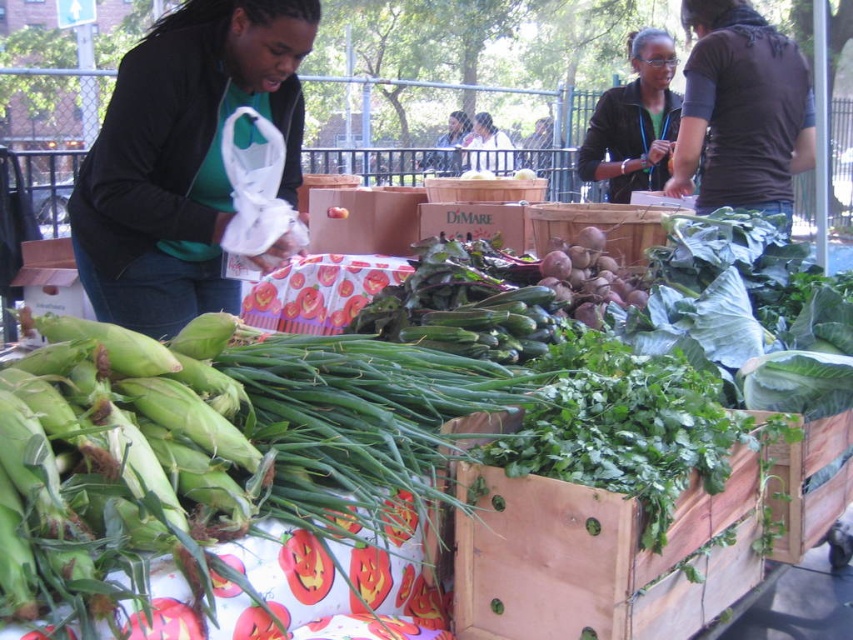
Question: Does matte green shirt at center lie behind green fabric shirt at upper center?

Choices:
 (A) yes
 (B) no

Answer: (B)

Question: Estimate the real-world distances between objects in this image. Which object is closer to the matte green shirt at center?

Choices:
 (A) green matte jacket at upper left
 (B) dark brown shirt at upper right

Answer: (B)

Question: Which point is farther from the camera taking this photo?

Choices:
 (A) (503, 156)
 (B) (428, 161)

Answer: (A)

Question: Among these objects, which one is farthest from the camera?

Choices:
 (A) green fabric shirt at upper center
 (B) green matte jacket at upper left
 (C) green matte corn at left
 (D) matte black jacket at upper right

Answer: (A)

Question: Is matte black jacket at upper right closer to camera compared to green fabric shirt at upper center?

Choices:
 (A) yes
 (B) no

Answer: (A)

Question: Can you confirm if matte black jacket at upper right is wider than green fabric shirt at upper center?

Choices:
 (A) no
 (B) yes

Answer: (B)